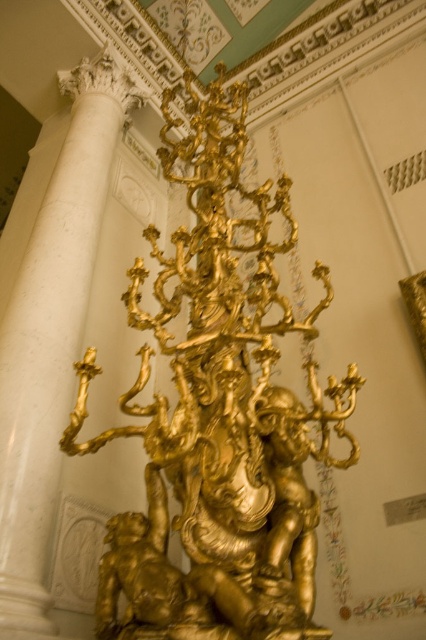
Describe the element at coordinates (218, 413) in the screenshot. Image resolution: width=426 pixels, height=640 pixels. I see `gold polished statue at center` at that location.

Who is more distant from viewer, [278,332] or [42,227]?

The point [42,227] is more distant.

Find the location of a particular element. gold polished statue at center is located at coordinates (218, 413).